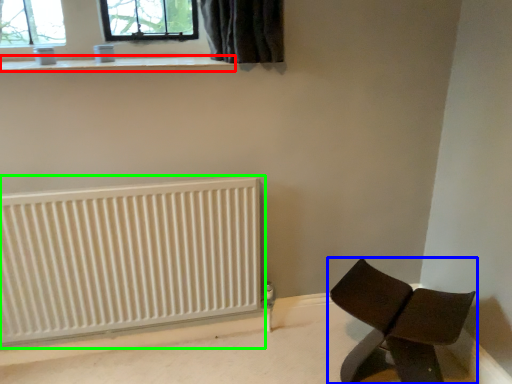
Question: Based on their relative distances, which object is nearer to window sill (highlighted by a red box)? Choose from furniture (highlighted by a blue box) and radiator (highlighted by a green box).

Choices:
 (A) furniture
 (B) radiator

Answer: (B)